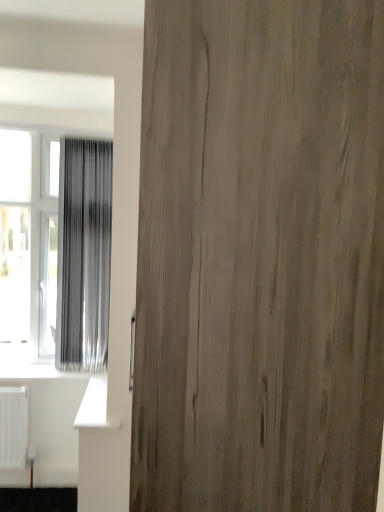
Question: Considering the relative positions of wooden door at center and silvery metallic curtain at left in the image provided, is wooden door at center to the left or to the right of silvery metallic curtain at left?

Choices:
 (A) left
 (B) right

Answer: (B)

Question: Considering the positions of wooden door at center and silvery metallic curtain at left in the image, is wooden door at center taller or shorter than silvery metallic curtain at left?

Choices:
 (A) short
 (B) tall

Answer: (B)

Question: Which of these objects is positioned farthest from the wooden door at center?

Choices:
 (A) transparent plastic window at left
 (B) silvery metallic curtain at left

Answer: (A)

Question: Which of these objects is positioned farthest from the wooden door at center?

Choices:
 (A) silvery metallic curtain at left
 (B) transparent plastic window at left

Answer: (B)